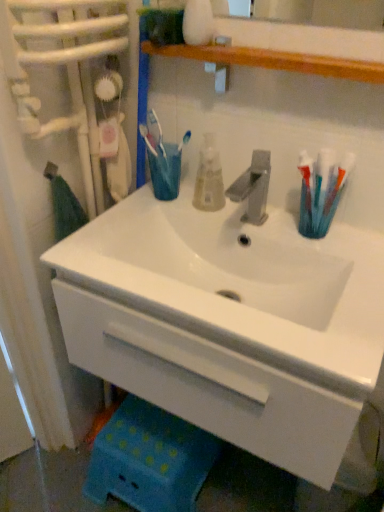
Question: Considering the relative sizes of translucent plastic toothbrushes at right and white glossy sink at center in the image provided, is translucent plastic toothbrushes at right shorter than white glossy sink at center?

Choices:
 (A) no
 (B) yes

Answer: (B)

Question: From the image's perspective, is translucent plastic toothbrushes at right located beneath white glossy sink at center?

Choices:
 (A) yes
 (B) no

Answer: (B)

Question: From the image's perspective, is translucent plastic toothbrushes at right over white glossy sink at center?

Choices:
 (A) yes
 (B) no

Answer: (A)

Question: Is translucent plastic toothbrushes at right positioned far away from white glossy sink at center?

Choices:
 (A) yes
 (B) no

Answer: (B)

Question: Is translucent plastic toothbrushes at right looking in the opposite direction of white glossy sink at center?

Choices:
 (A) yes
 (B) no

Answer: (B)

Question: Considering the relative positions of translucent plastic toothbrushes at right and white glossy sink at center in the image provided, is translucent plastic toothbrushes at right to the right of white glossy sink at center from the viewer's perspective?

Choices:
 (A) yes
 (B) no

Answer: (A)

Question: Is translucent plastic mouthwash at center at the right side of white glossy sink at center?

Choices:
 (A) no
 (B) yes

Answer: (A)

Question: Considering the relative sizes of translucent plastic mouthwash at center and white glossy sink at center in the image provided, is translucent plastic mouthwash at center wider than white glossy sink at center?

Choices:
 (A) yes
 (B) no

Answer: (B)

Question: Is translucent plastic mouthwash at center with white glossy sink at center?

Choices:
 (A) no
 (B) yes

Answer: (A)

Question: Can you confirm if translucent plastic mouthwash at center is bigger than white glossy sink at center?

Choices:
 (A) no
 (B) yes

Answer: (A)

Question: Can you confirm if translucent plastic mouthwash at center is positioned to the left of white glossy sink at center?

Choices:
 (A) no
 (B) yes

Answer: (B)

Question: Is translucent plastic mouthwash at center turned away from white glossy sink at center?

Choices:
 (A) no
 (B) yes

Answer: (A)

Question: Is white glossy sink at center aimed at translucent plastic toothbrushes at right?

Choices:
 (A) no
 (B) yes

Answer: (A)